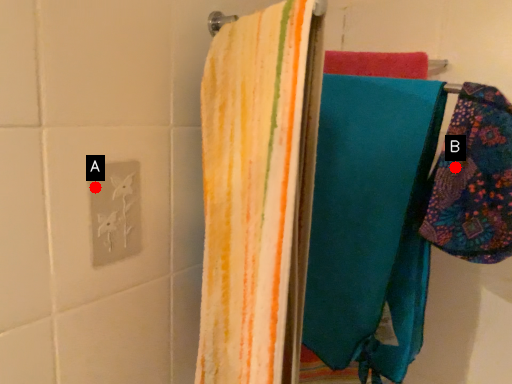
Question: Two points are circled on the image, labeled by A and B beside each circle. Which point appears farthest from the camera in this image?

Choices:
 (A) A is further
 (B) B is further

Answer: (A)